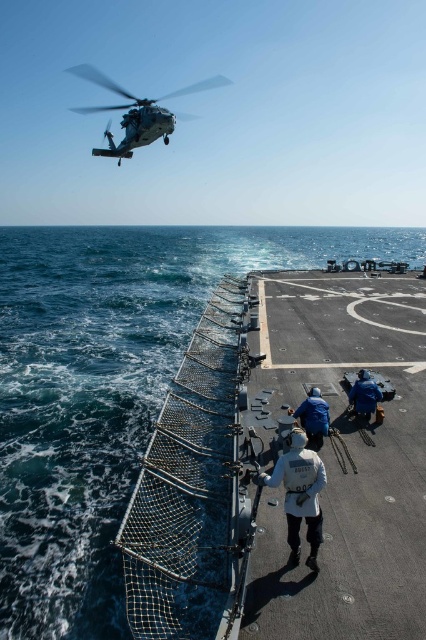
Question: Which object is farther from the camera taking this photo?

Choices:
 (A) blue water at lower left
 (B) white fabric jacket at center
 (C) metallic gray helicopter at upper center

Answer: (C)

Question: Can you confirm if metallic gray helicopter at upper center is thinner than blue fabric jacket at lower right?

Choices:
 (A) no
 (B) yes

Answer: (A)

Question: Which point is closer to the camera?

Choices:
 (A) (16, 518)
 (B) (305, 432)
 (C) (146, 131)

Answer: (B)

Question: Is white fabric jacket at center below blue fabric jacket at lower right?

Choices:
 (A) no
 (B) yes

Answer: (B)

Question: Which of the following is the farthest from the observer?

Choices:
 (A) (149, 113)
 (B) (362, 371)
 (C) (92, 232)
 (D) (316, 435)

Answer: (C)

Question: Can you confirm if blue water at lower left is smaller than metallic gray helicopter at upper center?

Choices:
 (A) yes
 (B) no

Answer: (A)